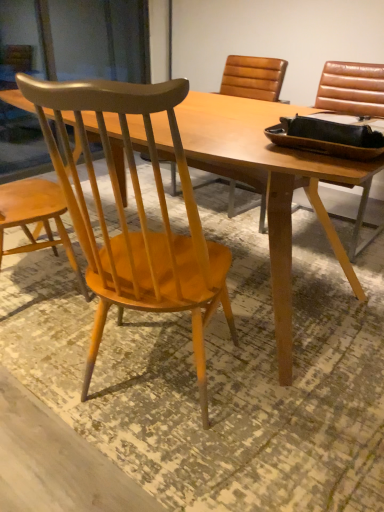
Question: Should I look upward or downward to see light brown wood chair at left?

Choices:
 (A) down
 (B) up

Answer: (B)